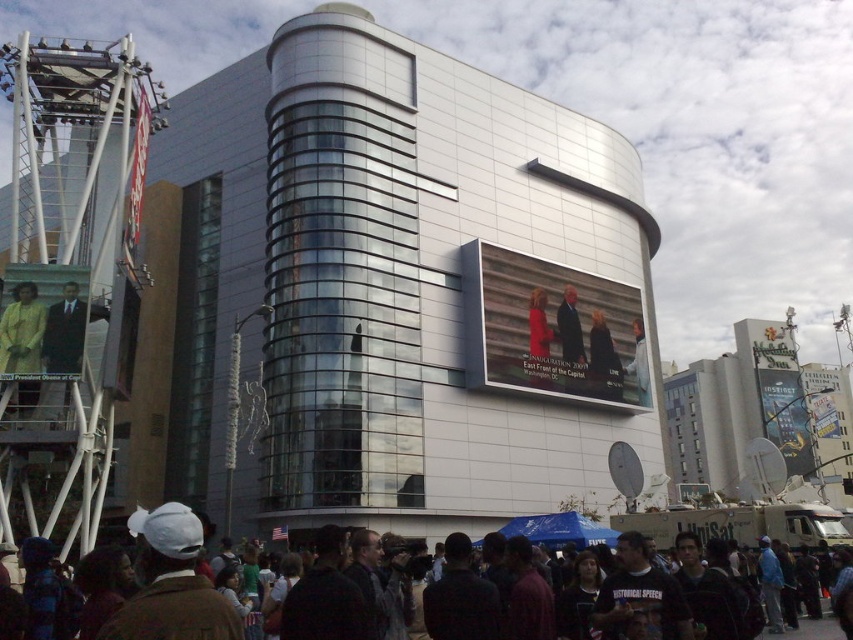
Is matte yellow jacket at left shorter than matte black suit at center?

No, matte yellow jacket at left is not shorter than matte black suit at center.

Does matte yellow jacket at left appear over matte black suit at center?

Yes, matte yellow jacket at left is above matte black suit at center.

Identify the location of matte yellow jacket at left. The image size is (853, 640). (21, 330).

Does metallic silver sign at center have a smaller size compared to dark blue suit at center?

No, metallic silver sign at center is not smaller than dark blue suit at center.

Looking at this image, who is positioned more to the right, metallic silver sign at center or dark blue suit at center?

From the viewer's perspective, metallic silver sign at center appears more on the right side.

Is point (785, 385) positioned in front of point (598, 371)?

No, it is behind (598, 371).

Find the location of `metallic silver sign at center`. metallic silver sign at center is located at coordinates (786, 417).

Who is positioned more to the left, matte digital display at center or light brown leather jacket at upper center?

Positioned to the left is matte digital display at center.

Describe the element at coordinates (554, 330) in the screenshot. I see `matte digital display at center` at that location.

Image resolution: width=853 pixels, height=640 pixels. I want to click on matte digital display at center, so click(554, 330).